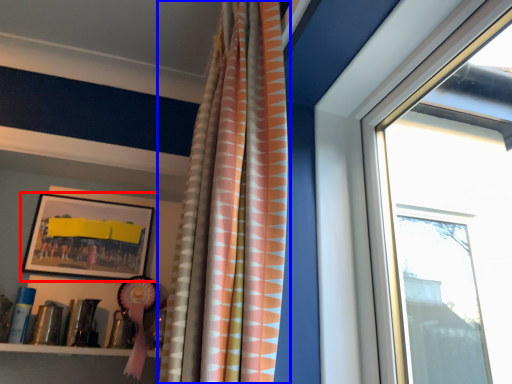
Question: Which object appears farthest to the camera in this image, picture frame (highlighted by a red box) or curtain (highlighted by a blue box)?

Choices:
 (A) picture frame
 (B) curtain

Answer: (A)